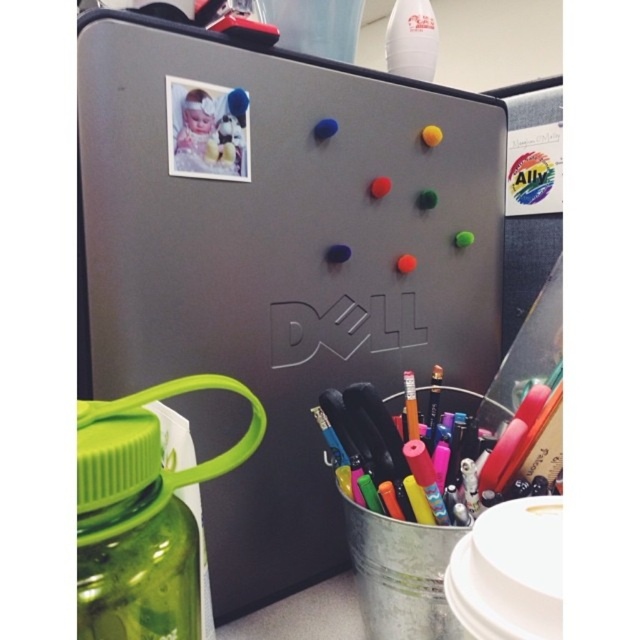
Question: Does metallic gray fridge at center have a smaller size compared to green plastic water bottle at lower left?

Choices:
 (A) yes
 (B) no

Answer: (B)

Question: Is the position of metallic gray fridge at center less distant than that of metallic pen at center?

Choices:
 (A) no
 (B) yes

Answer: (B)

Question: Which of the following is the closest to the observer?

Choices:
 (A) (320, 289)
 (B) (355, 413)
 (C) (144, 630)

Answer: (C)

Question: Can you confirm if green plastic water bottle at lower left is wider than metallic pen at center?

Choices:
 (A) yes
 (B) no

Answer: (B)

Question: Which object is closer to the camera taking this photo?

Choices:
 (A) green plastic water bottle at lower left
 (B) metallic pen at center

Answer: (A)

Question: Which is nearer to the metallic pen at center?

Choices:
 (A) green plastic water bottle at lower left
 (B) metallic gray fridge at center

Answer: (B)